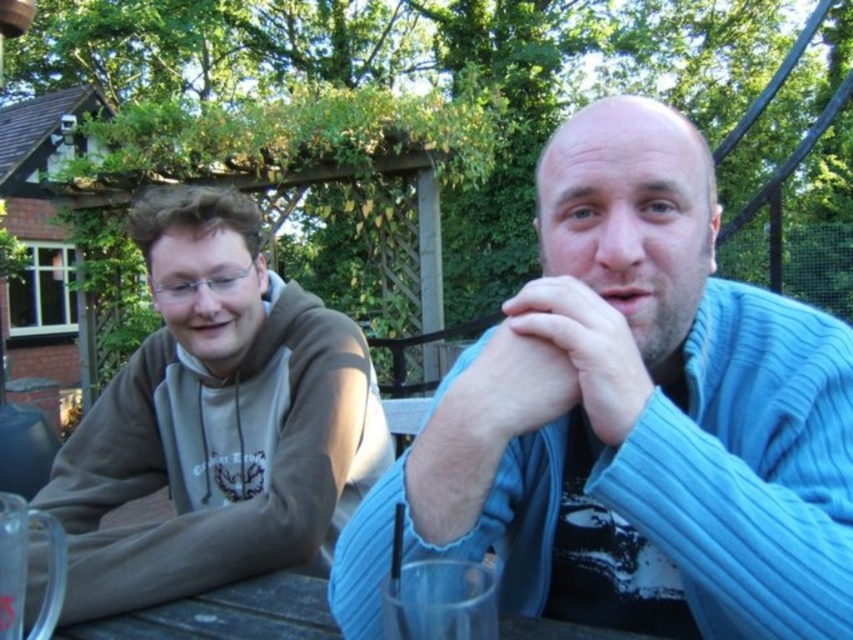
Question: Which of the following is the farthest from the observer?

Choices:
 (A) blue ribbed sweater at center
 (B) gray hoodie at left
 (C) wooden table at lower center

Answer: (B)

Question: Is blue ribbed sweater at center further to camera compared to gray hoodie at left?

Choices:
 (A) no
 (B) yes

Answer: (A)

Question: Which of the following is the farthest from the observer?

Choices:
 (A) blue ribbed sweater at center
 (B) wooden table at lower center

Answer: (B)

Question: Which point appears farthest from the camera in this image?

Choices:
 (A) (134, 621)
 (B) (486, 426)

Answer: (A)

Question: In this image, where is blue ribbed sweater at center located relative to gray hoodie at left?

Choices:
 (A) above
 (B) below

Answer: (A)

Question: Is gray hoodie at left in front of wooden table at lower center?

Choices:
 (A) no
 (B) yes

Answer: (A)